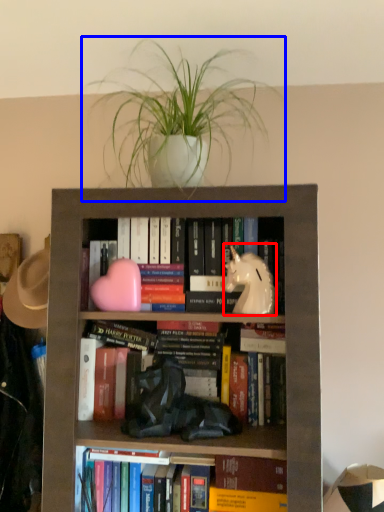
Question: Which of the following is the closest to the observer, animal (highlighted by a red box) or houseplant (highlighted by a blue box)?

Choices:
 (A) animal
 (B) houseplant

Answer: (B)